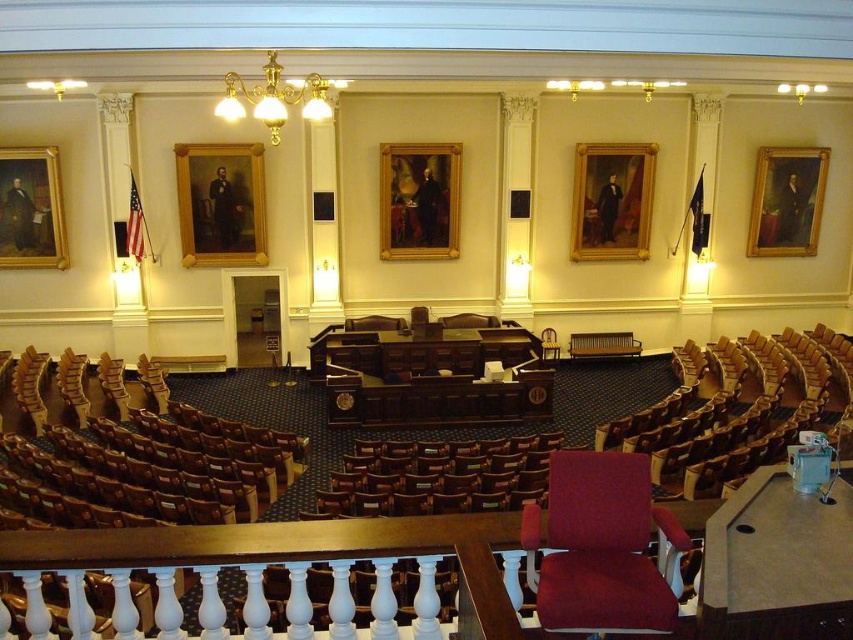
Is goldwooden frame at upper center below gold-framed portrait at center-right?

Yes.

Is goldwooden frame at upper center behind gold-framed portrait at center-right?

That is False.

Is point (216, 184) less distant than point (608, 177)?

Yes, it is in front of point (608, 177).

Find the location of a particular element. goldwooden frame at upper center is located at coordinates (219, 204).

Can you confirm if brown leather chair at center is shorter than wooden chair at center?

Indeed, brown leather chair at center has a lesser height compared to wooden chair at center.

From the picture: Is brown leather chair at center behind wooden chair at center?

No.

I want to click on brown leather chair at center, so click(436, 476).

In the scene shown: Measure the distance between brown leather chair at left and camera.

brown leather chair at left is 29.17 feet away from camera.

The width and height of the screenshot is (853, 640). I want to click on brown leather chair at left, so click(x=146, y=470).

Is point (193, 428) more distant than point (556, 529)?

Yes, it is behind point (556, 529).

Image resolution: width=853 pixels, height=640 pixels. In order to click on brown leather chair at left in this screenshot , I will do pyautogui.click(x=146, y=470).